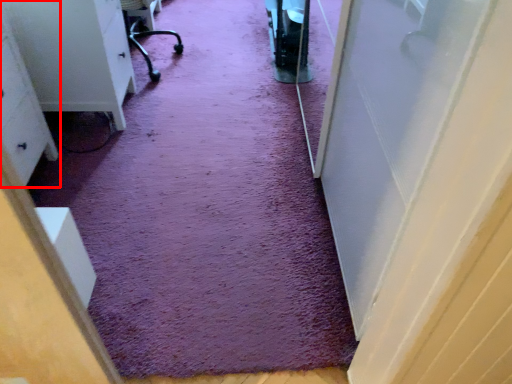
Question: From the image's perspective, where is furniture (annotated by the red box) located relative to doormat?

Choices:
 (A) above
 (B) below

Answer: (B)